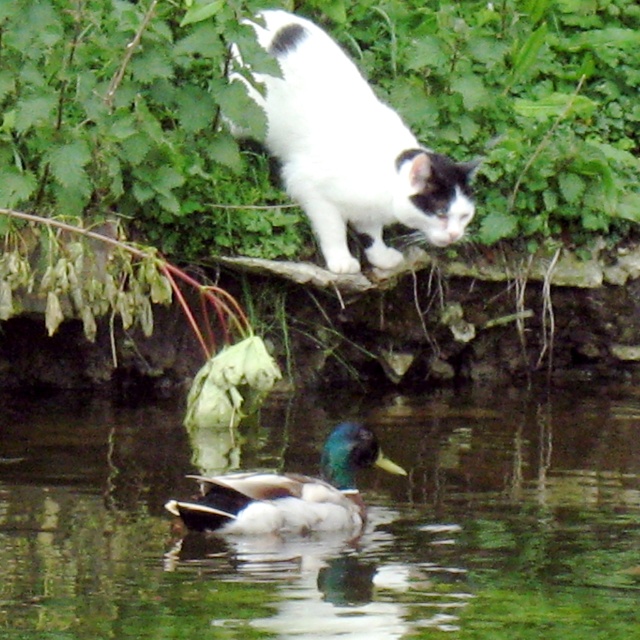
Question: Which of the following is the farthest from the observer?

Choices:
 (A) white fur cat at upper center
 (B) green glossy duck at lower center
 (C) green leafy vegetation at upper center
 (D) white fluffy duck at lower center

Answer: (C)

Question: Is white fluffy duck at lower center further to the viewer compared to white fur cat at upper center?

Choices:
 (A) no
 (B) yes

Answer: (A)

Question: Which of the following is the farthest from the observer?

Choices:
 (A) (385, 266)
 (B) (141, 198)
 (C) (353, 516)

Answer: (A)

Question: Which point is closer to the camera?

Choices:
 (A) (579, 234)
 (B) (253, 634)

Answer: (B)

Question: Can you confirm if green leafy vegetation at upper center is wider than white fur cat at upper center?

Choices:
 (A) no
 (B) yes

Answer: (B)

Question: From the image, what is the correct spatial relationship of white fluffy duck at lower center in relation to green leafy vegetation at upper center?

Choices:
 (A) left
 (B) right

Answer: (A)